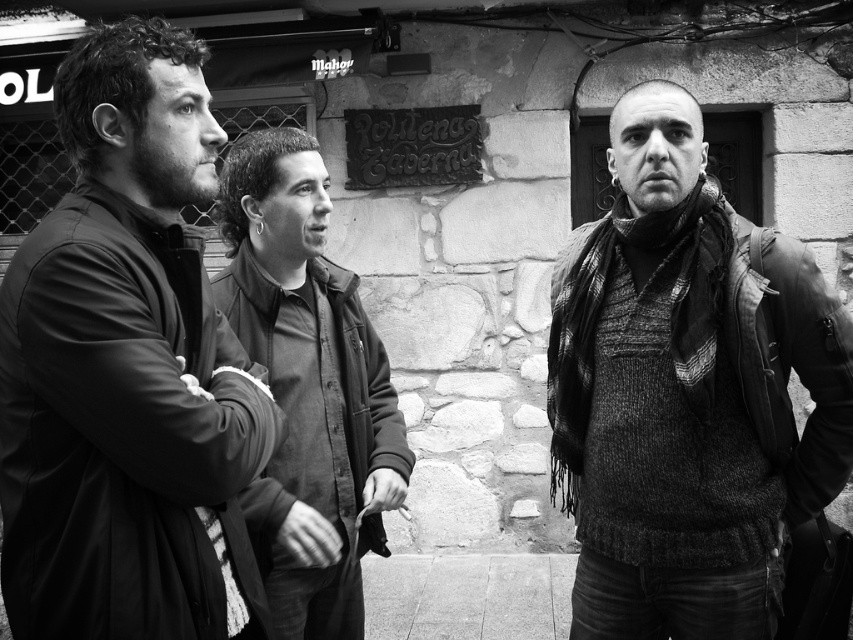
Question: Is matte black jacket at left thinner than dark gray jacket at center?

Choices:
 (A) no
 (B) yes

Answer: (B)

Question: Which point appears farthest from the camera in this image?

Choices:
 (A) (631, 417)
 (B) (360, 518)
 (C) (152, 579)

Answer: (B)

Question: Is matte black jacket at left to the left of dark gray jacket at center from the viewer's perspective?

Choices:
 (A) no
 (B) yes

Answer: (B)

Question: Estimate the real-world distances between objects in this image. Which object is closer to the matte black jacket at left?

Choices:
 (A) knitted sweater at right
 (B) dark gray jacket at center

Answer: (B)

Question: Is matte black jacket at left closer to the viewer compared to dark gray jacket at center?

Choices:
 (A) no
 (B) yes

Answer: (B)

Question: Estimate the real-world distances between objects in this image. Which object is farther from the matte black jacket at left?

Choices:
 (A) knitted sweater at right
 (B) dark gray jacket at center

Answer: (A)